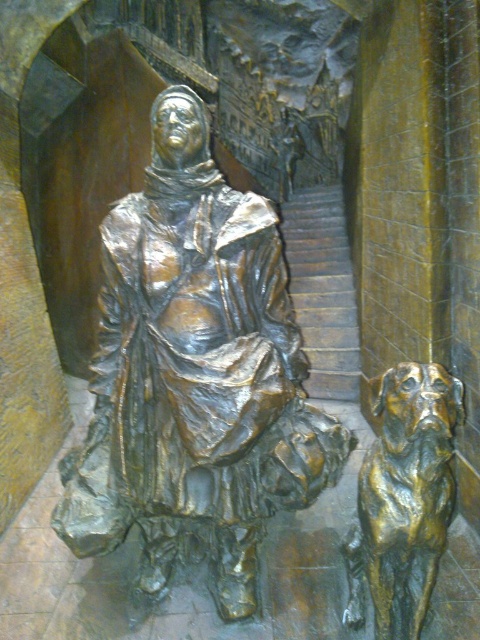
You are an art conservator examining the bronze sculpture. You notice two points on the sculpture marked at coordinates point (116,369) and point (382,538). Which point is closer to you?

Point (116,369) is closer to you because it is further to the viewer than point (382,538).

You are an art conservator examining the bronze statue at center. Based on its location coordinates, can you determine if it is positioned exactly at the center of the image?

The bronze statue at center is located at coordinates point (x=194, y=376), which is slightly offset from the true center of the image. Therefore, it is not exactly at the center.